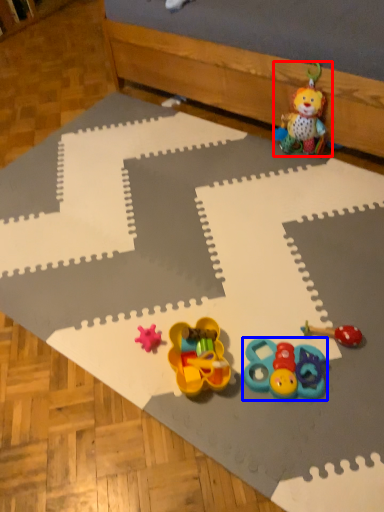
Question: Which of the following is the farthest to the observer, toy (highlighted by a red box) or toy (highlighted by a blue box)?

Choices:
 (A) toy
 (B) toy

Answer: (A)